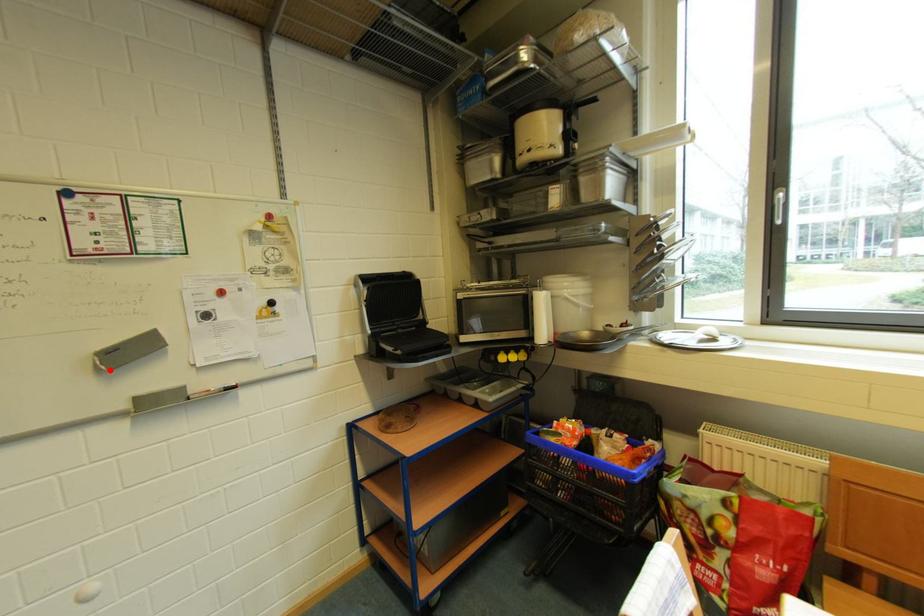
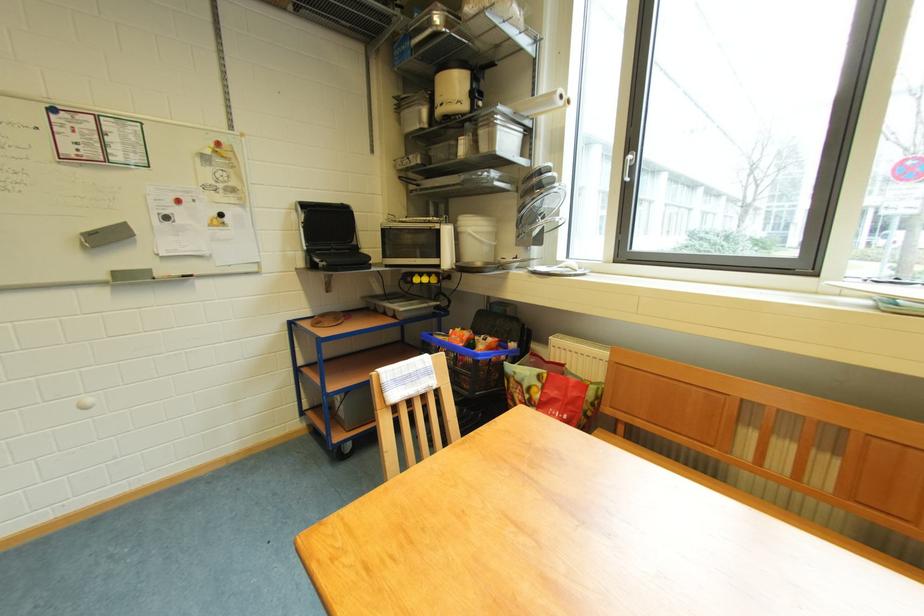
The point at the highlighted location is marked in the first image. Where is the corresponding point in the second image?

(95, 248)